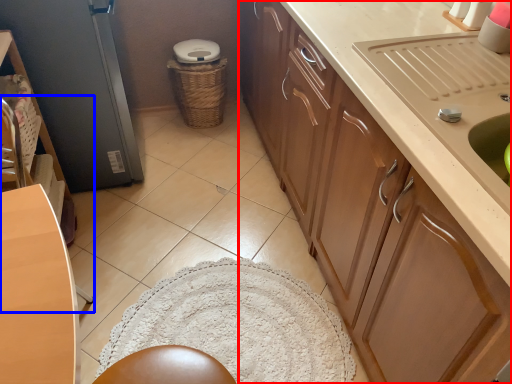
Question: Among these objects, which one is nearest to the camera, cabinetry (highlighted by a red box) or chair (highlighted by a blue box)?

Choices:
 (A) cabinetry
 (B) chair

Answer: (A)